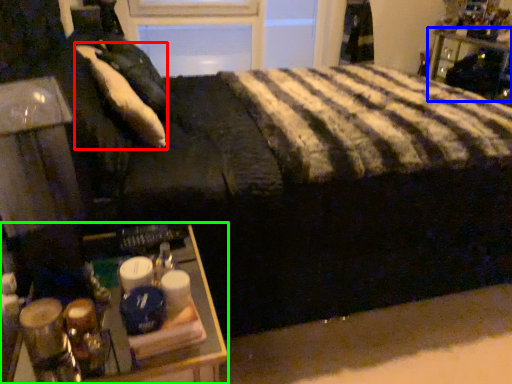
Question: Which is nearer to the pillow (highlighted by a red box)? furniture (highlighted by a blue box) or table (highlighted by a green box).

Choices:
 (A) furniture
 (B) table

Answer: (B)